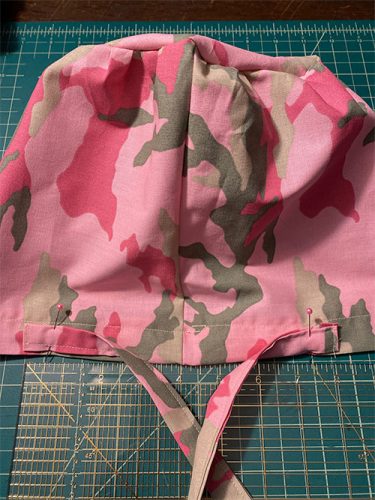
This screenshot has height=500, width=375. In order to click on measuring mat in this screenshot , I will do `click(357, 55)`.